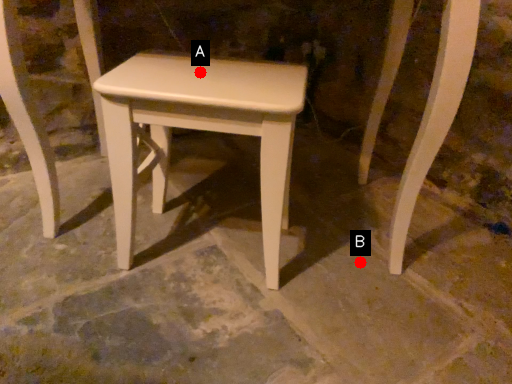
Question: Two points are circled on the image, labeled by A and B beside each circle. Among these points, which one is farthest from the camera?

Choices:
 (A) A is further
 (B) B is further

Answer: (B)